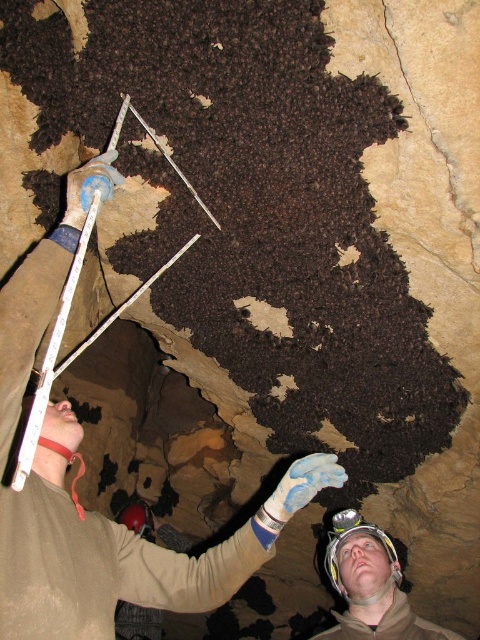
Question: Which point is closer to the camera?

Choices:
 (A) (363, 589)
 (B) (54, 627)

Answer: (B)

Question: Is tan leather glove at upper center smaller than white hard hat at center?

Choices:
 (A) no
 (B) yes

Answer: (A)

Question: Which point is closer to the camera?

Choices:
 (A) tan leather glove at upper center
 (B) white hard hat at center

Answer: (A)

Question: Which of the following is the farthest from the observer?

Choices:
 (A) white hard hat at center
 (B) tan leather glove at upper center

Answer: (A)

Question: From the image, what is the correct spatial relationship of tan leather glove at upper center in relation to white hard hat at center?

Choices:
 (A) right
 (B) left

Answer: (B)

Question: Can you confirm if tan leather glove at upper center is positioned to the right of white hard hat at center?

Choices:
 (A) yes
 (B) no

Answer: (B)